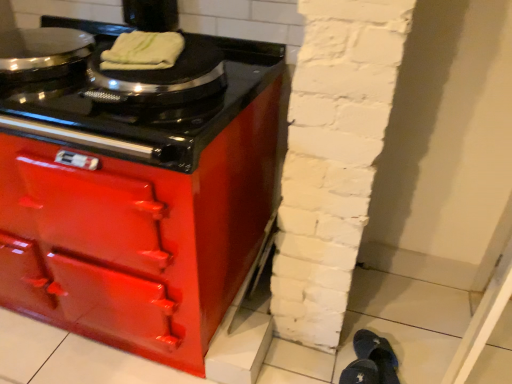
Question: Should I look upward or downward to see glossy black cooktop at upper left?

Choices:
 (A) down
 (B) up

Answer: (B)